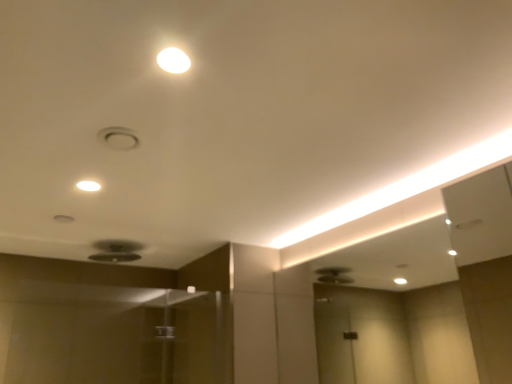
Identify the location of white glossy light at upper center. (173, 60).

Describe the element at coordinates (173, 60) in the screenshot. This screenshot has width=512, height=384. I see `white glossy light at upper center` at that location.

Measure the distance between point (161, 63) and camera.

A distance of 38.66 inches exists between point (161, 63) and camera.

You are a GUI agent. You are given a task and a screenshot of the screen. Output one action in this format:
    pyautogui.click(x=<x>, y=<y>)
    Task: Click on the white glossy light at upper center
    
    Given the screenshot: What is the action you would take?
    pyautogui.click(x=173, y=60)